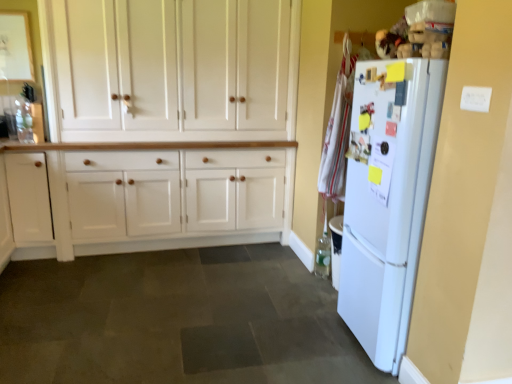
Question: Are white wood cabinet at left, which ranks as the first cabinetry in left-to-right order, and white matte refrigerator at right located far from each other?

Choices:
 (A) yes
 (B) no

Answer: (A)

Question: Can you confirm if white wood cabinet at left, which ranks as the first cabinetry in left-to-right order, is thinner than white matte refrigerator at right?

Choices:
 (A) no
 (B) yes

Answer: (B)

Question: Does white wood cabinet at left, which ranks as the first cabinetry in left-to-right order, have a larger size compared to white matte refrigerator at right?

Choices:
 (A) no
 (B) yes

Answer: (A)

Question: Can you confirm if white wood cabinet at left, the 2th cabinetry when ordered from right to left, is smaller than white matte refrigerator at right?

Choices:
 (A) no
 (B) yes

Answer: (B)

Question: From the image's perspective, would you say white wood cabinet at left, which ranks as the first cabinetry in left-to-right order, is shown under white matte refrigerator at right?

Choices:
 (A) no
 (B) yes

Answer: (A)

Question: From a real-world perspective, relative to white wood cabinet at center, which appears as the 2th cabinetry when viewed from the left, is white wood cabinet at left, which ranks as the first cabinetry in left-to-right order, vertically above or below?

Choices:
 (A) below
 (B) above

Answer: (A)

Question: Is white wood cabinet at left, which ranks as the first cabinetry in left-to-right order, wider or thinner than white wood cabinet at center, which appears as the 2th cabinetry when viewed from the left?

Choices:
 (A) wide
 (B) thin

Answer: (A)

Question: Is white wood cabinet at left, the 2th cabinetry when ordered from right to left, to the left or to the right of white wood cabinet at center, which ranks as the first cabinetry in right-to-left order, in the image?

Choices:
 (A) right
 (B) left

Answer: (B)

Question: From the image's perspective, is white wood cabinet at left, the 2th cabinetry when ordered from right to left, located above or below white wood cabinet at center, which ranks as the first cabinetry in right-to-left order?

Choices:
 (A) above
 (B) below

Answer: (B)

Question: Is white matte refrigerator at right in front of or behind white wood cabinet at center, which ranks as the first cabinetry in right-to-left order, in the image?

Choices:
 (A) front
 (B) behind

Answer: (A)

Question: In terms of width, does white matte refrigerator at right look wider or thinner when compared to white wood cabinet at center, which appears as the 2th cabinetry when viewed from the left?

Choices:
 (A) wide
 (B) thin

Answer: (A)

Question: Is point (431, 87) closer or farther from the camera than point (159, 43)?

Choices:
 (A) closer
 (B) farther

Answer: (A)

Question: From a real-world perspective, is white matte refrigerator at right physically located above or below white wood cabinet at center, which ranks as the first cabinetry in right-to-left order?

Choices:
 (A) below
 (B) above

Answer: (A)

Question: Based on their sizes in the image, would you say white wood cabinet at center, which ranks as the first cabinetry in right-to-left order, is bigger or smaller than dark gray tile floor at center?

Choices:
 (A) big
 (B) small

Answer: (A)

Question: Relative to dark gray tile floor at center, is white wood cabinet at center, which ranks as the first cabinetry in right-to-left order, in front or behind?

Choices:
 (A) behind
 (B) front

Answer: (A)